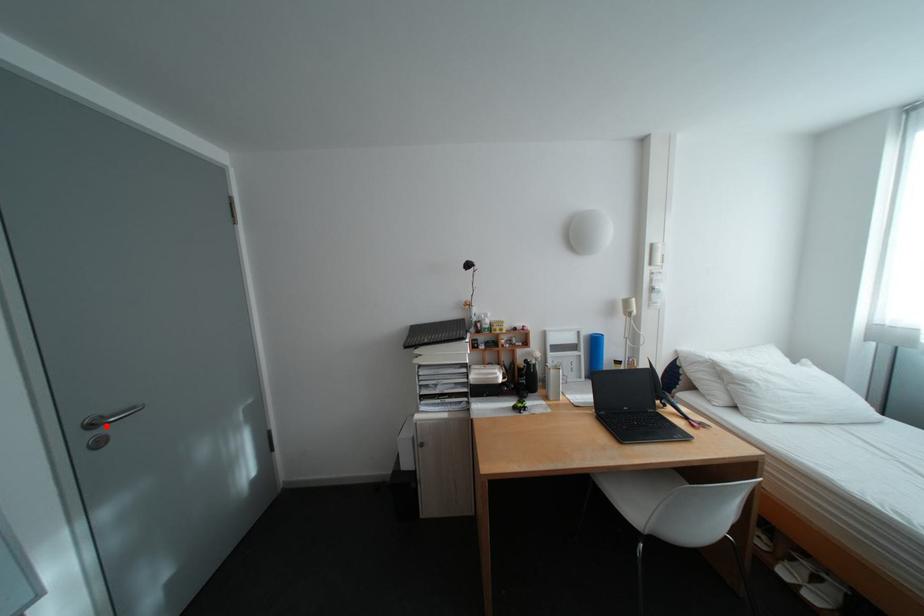
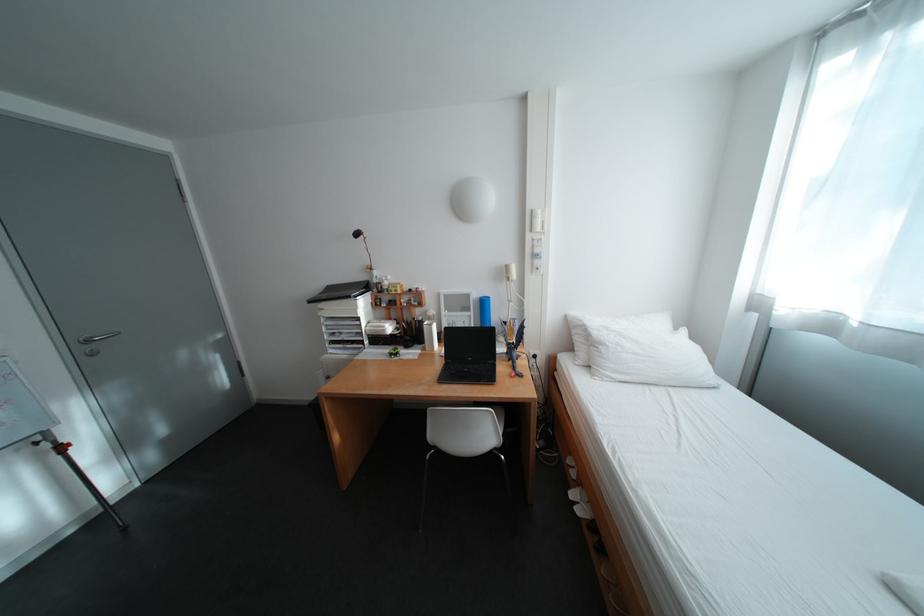
The point at the highlighted location is marked in the first image. Where is the corresponding point in the second image?

(100, 342)